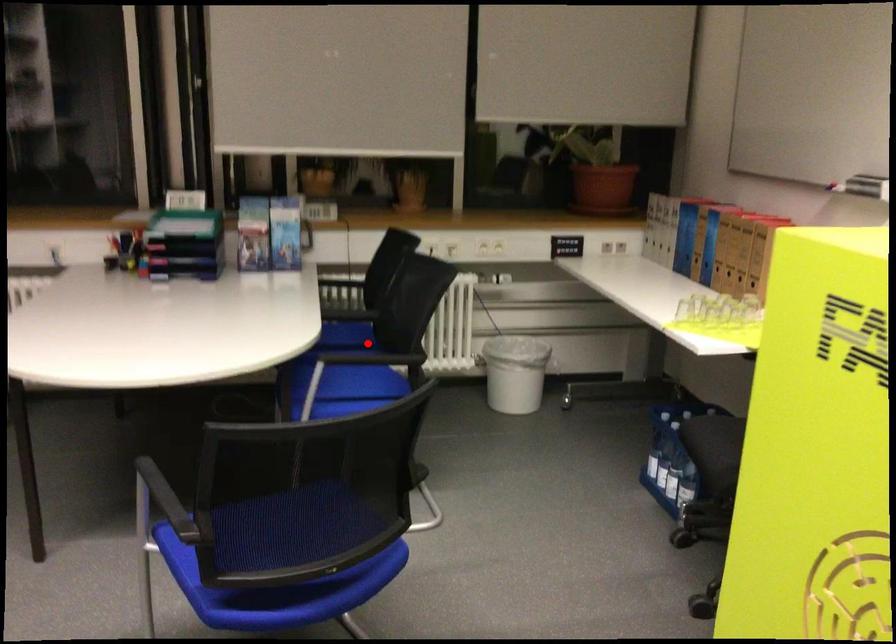
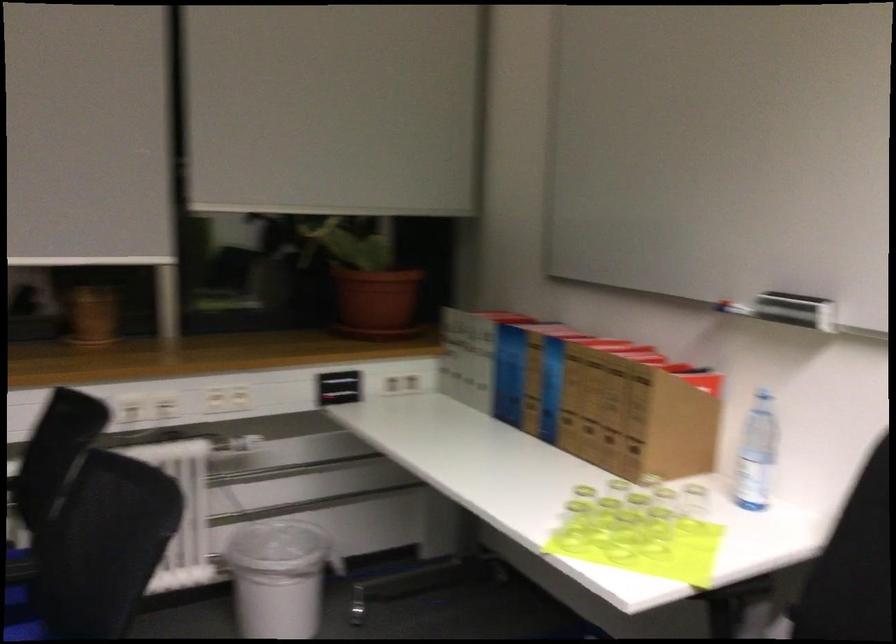
In the second image, find the point that corresponds to the highlighted location in the first image.

(23, 603)